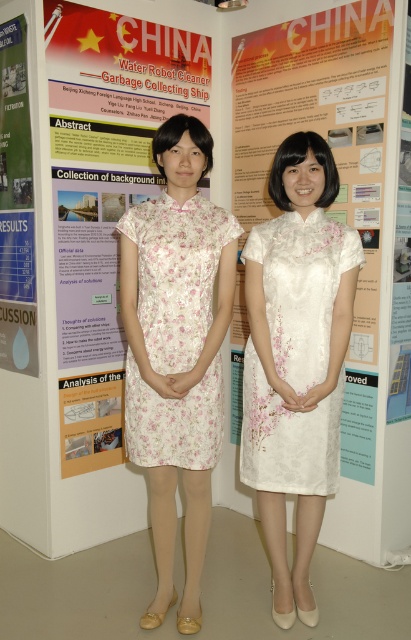
Question: Is floral satin dress at center above blue glossy poster at left?

Choices:
 (A) no
 (B) yes

Answer: (A)

Question: Among these objects, which one is farthest from the camera?

Choices:
 (A) floral satin dress at center
 (B) white floral dress at center
 (C) blue glossy poster at left

Answer: (C)

Question: Which object is closer to the camera taking this photo?

Choices:
 (A) white paper poster at center
 (B) blue glossy poster at left

Answer: (B)

Question: Is the position of blue glossy poster at left more distant than that of white paper poster at center?

Choices:
 (A) yes
 (B) no

Answer: (B)

Question: Considering the real-world distances, which object is closest to the floral satin dress at center?

Choices:
 (A) white paper poster at center
 (B) white floral dress at center
 (C) blue glossy poster at left

Answer: (B)

Question: Is floral satin dress at center positioned before white paper poster at center?

Choices:
 (A) no
 (B) yes

Answer: (B)